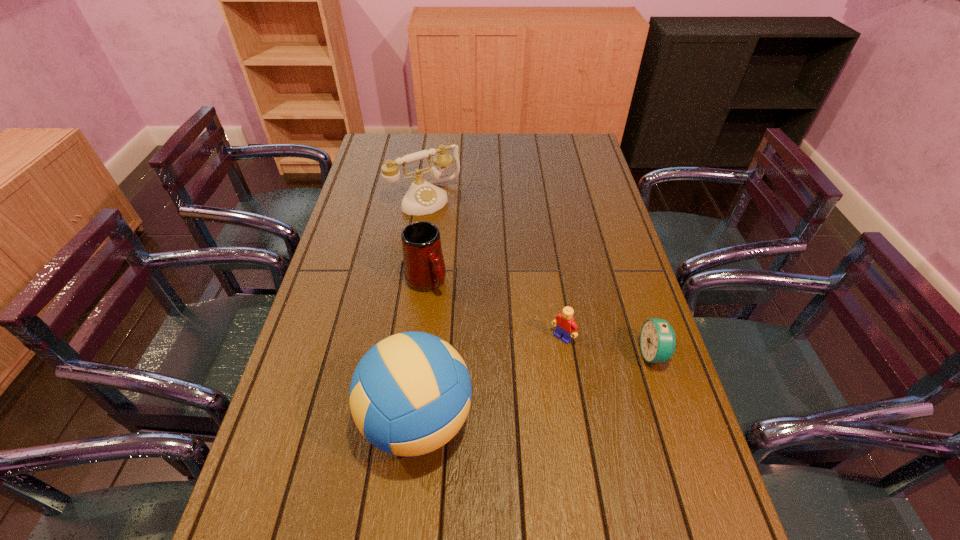
The height and width of the screenshot is (540, 960). Find the location of `the tallest object`. the tallest object is located at coordinates (410, 394).

Identify the location of the rightmost object. (657, 338).

I want to click on mug, so tap(424, 268).

Find the location of a particular element. Lego is located at coordinates (565, 326).

I want to click on the farthest object, so click(x=423, y=197).

Identify the location of vacant space positioned on the back of the volleyball. This screenshot has width=960, height=540. (432, 279).

This screenshot has width=960, height=540. Find the location of `vacant area situated on the front-facing side of the alarm clock`. vacant area situated on the front-facing side of the alarm clock is located at coordinates (605, 354).

Image resolution: width=960 pixels, height=540 pixels. I want to click on free point located on the front-facing side of the alarm clock, so click(x=526, y=354).

The height and width of the screenshot is (540, 960). What are the coordinates of `vacant space situated on the front-facing side of the alarm clock` in the screenshot? It's located at (589, 354).

Where is `vacant space situated on the side of the mug with the handle`? vacant space situated on the side of the mug with the handle is located at coordinates (453, 317).